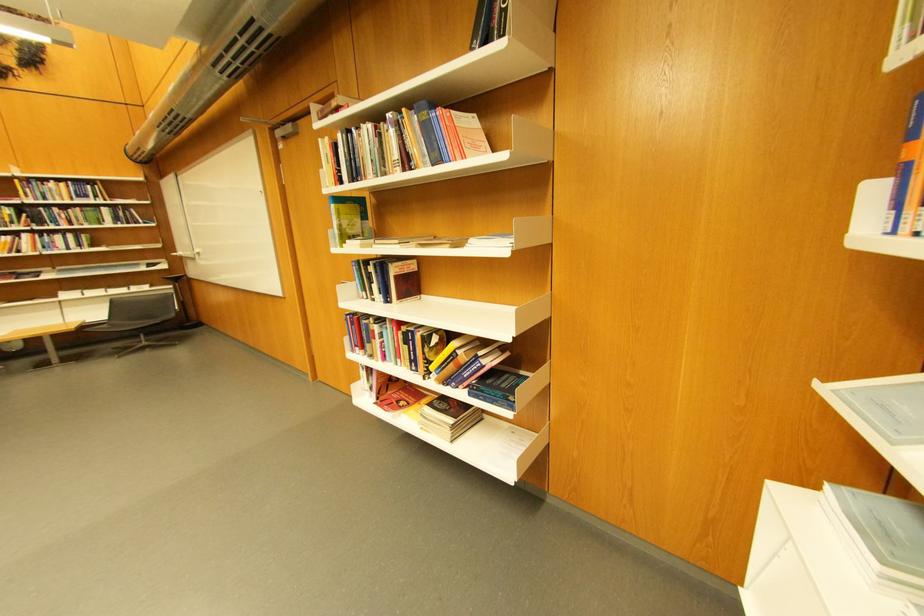
Find where to sit the chair sitting surface. Please return your answer as a coordinate pair (x, y).

(137, 322)